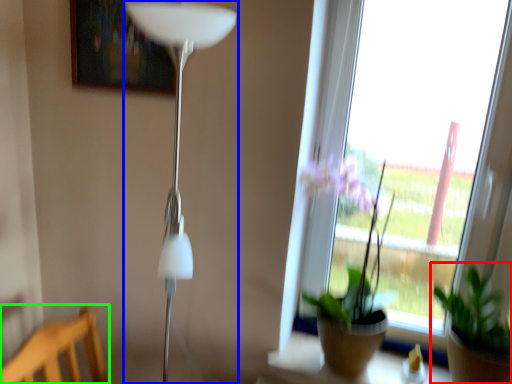
Question: Which object is positioned farthest from houseplant (highlighted by a red box)? Select from lamp (highlighted by a blue box) and furniture (highlighted by a green box).

Choices:
 (A) lamp
 (B) furniture

Answer: (B)